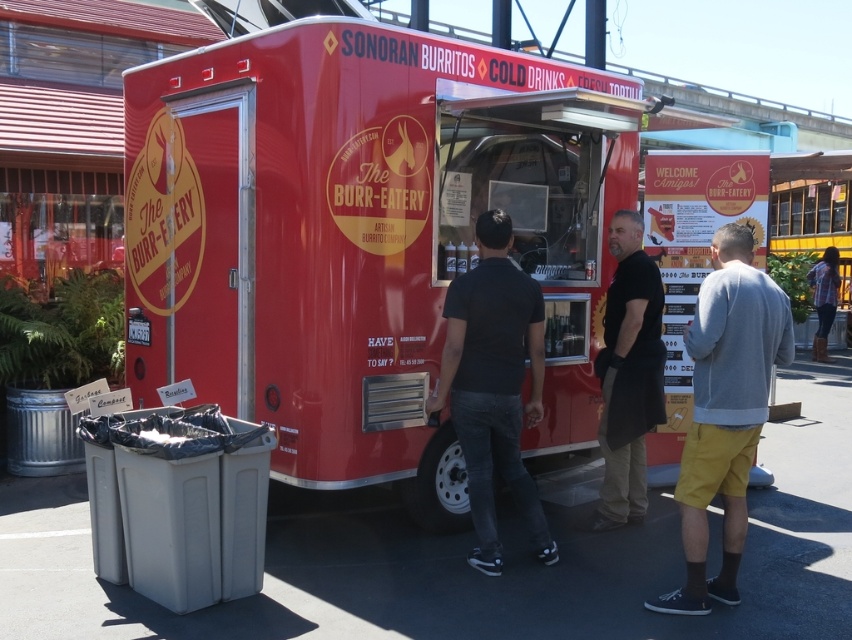
Question: Considering the relative positions of matte red food truck at center and smooth plastic trash can at lower left in the image provided, where is matte red food truck at center located with respect to smooth plastic trash can at lower left?

Choices:
 (A) left
 (B) right

Answer: (B)

Question: Is matte red food truck at center thinner than black matte apron at center?

Choices:
 (A) no
 (B) yes

Answer: (A)

Question: From the image, what is the correct spatial relationship of gray cotton sweatshirt at center in relation to smooth plastic trash can at lower left?

Choices:
 (A) left
 (B) right

Answer: (B)

Question: Which point is closer to the camera?

Choices:
 (A) black matte shirt at center
 (B) matte red food truck at center
 (C) smooth plastic trash can at lower left
 (D) gray cotton sweatshirt at center

Answer: (D)

Question: Which point appears closest to the camera in this image?

Choices:
 (A) (85, 531)
 (B) (332, 292)
 (C) (651, 342)
 (D) (680, 481)

Answer: (D)

Question: Which object is the closest to the black matte apron at center?

Choices:
 (A) smooth plastic trash can at lower left
 (B) matte red food truck at center

Answer: (B)